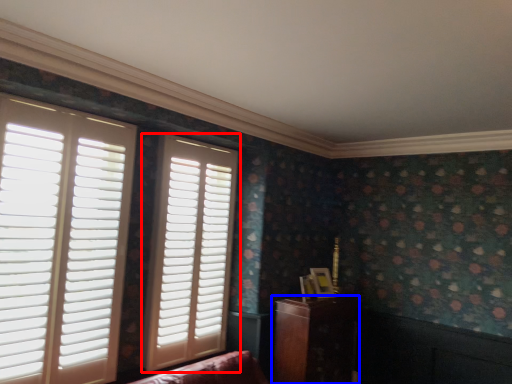
Question: Which point is further to the camera, window (highlighted by a red box) or furniture (highlighted by a blue box)?

Choices:
 (A) window
 (B) furniture

Answer: (B)